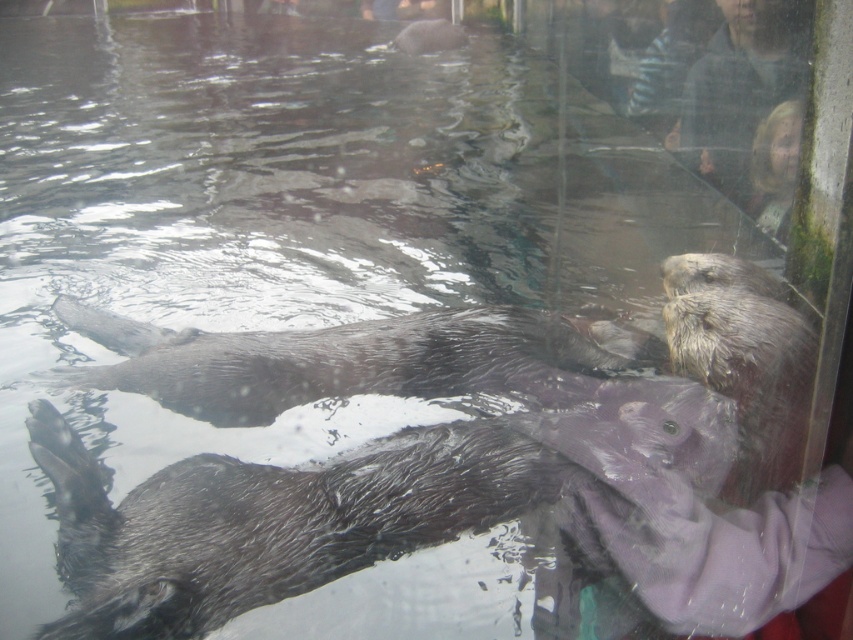
You are a zookeeper observing the otters in their enclosure. You notice the wet fur otter at lower left and the shiny brown otter at center. Which otter is taller?

The wet fur otter at lower left is taller than the shiny brown otter at center.

You are a zookeeper observing the otters through the enclosure glass. You need to determine the position of the wet fur otter at lower left relative to the shiny brown otter at center. Which otter is positioned lower in the image?

The wet fur otter at lower left is located below the shiny brown otter at center, so it is positioned lower in the image.